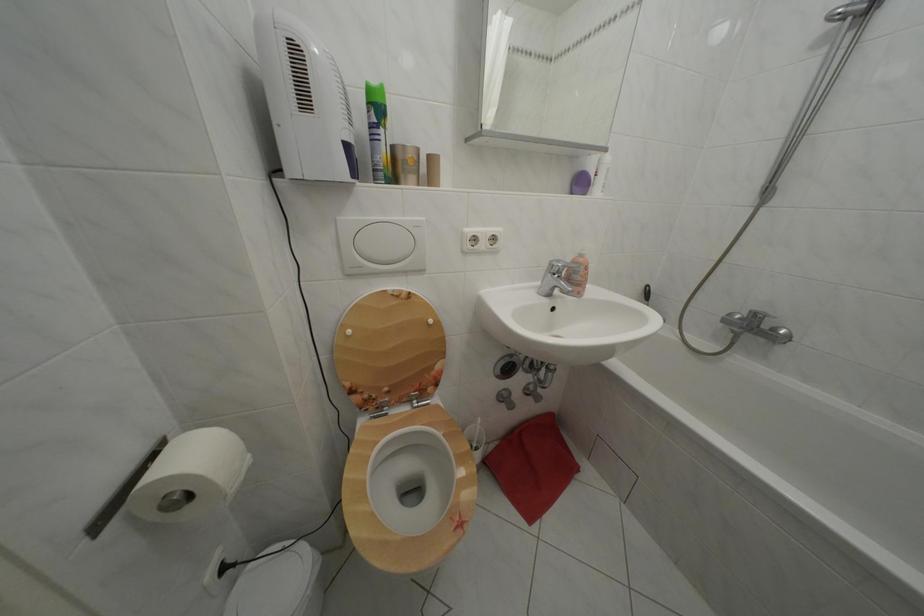
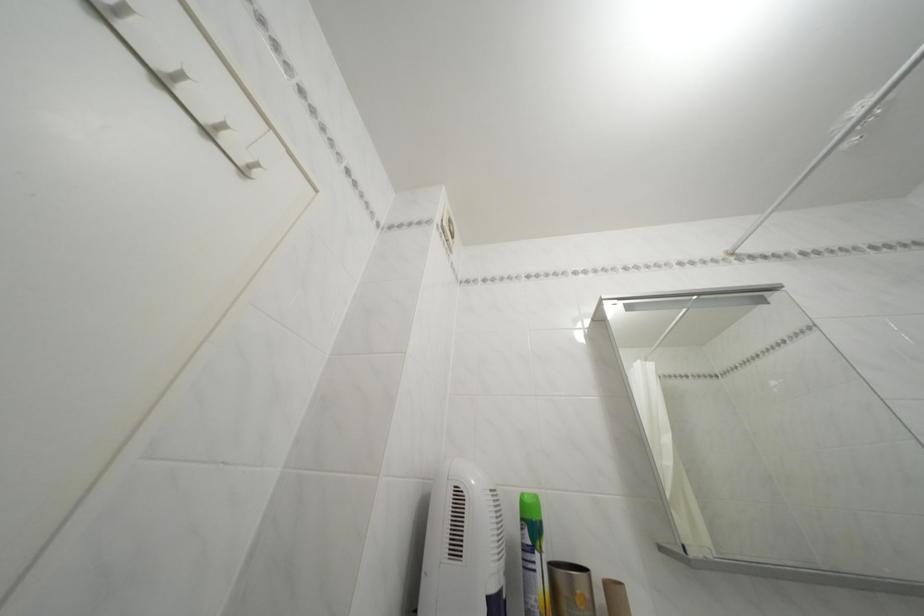
The point at (438, 161) is marked in the first image. Where is the corresponding point in the second image?

(614, 591)